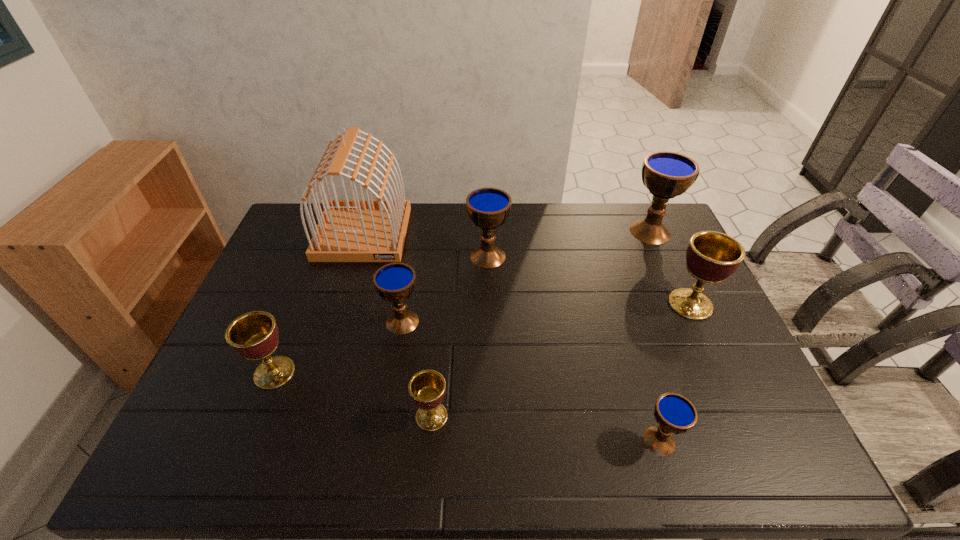
What are the coordinates of `the leftmost chalice` in the screenshot? It's located at (254, 335).

The image size is (960, 540). In order to click on the fifth farthest chalice in this screenshot , I will do `click(254, 335)`.

Where is `the nearest blue chalice`? The width and height of the screenshot is (960, 540). the nearest blue chalice is located at coordinates (674, 413).

Where is `the third blue chalice from left to right`? the third blue chalice from left to right is located at coordinates pyautogui.click(x=674, y=413).

The image size is (960, 540). What are the coordinates of `the smallest golden chalice` in the screenshot? It's located at (427, 388).

I want to click on the nearest golden chalice, so click(x=427, y=388).

Locate an element on the screen. vacant space located with an open door on the birdcage is located at coordinates (351, 272).

What are the coordinates of `vacant space located 0.380m on the front of the tallest chalice` in the screenshot? It's located at (696, 335).

At what (x,y) coordinates should I click in order to perform the action: click on vacant space located on the back of the fourth chalice from right to left. Please return your answer as a coordinate pair (x, y). This screenshot has height=540, width=960. Looking at the image, I should click on (488, 220).

You are a GUI agent. You are given a task and a screenshot of the screen. Output one action in this format:
    pyautogui.click(x=<x>, y=<y>)
    Task: Click on the blank area located on the left of the biggest golden chalice
    This screenshot has height=540, width=960.
    Given the screenshot: What is the action you would take?
    pyautogui.click(x=627, y=304)